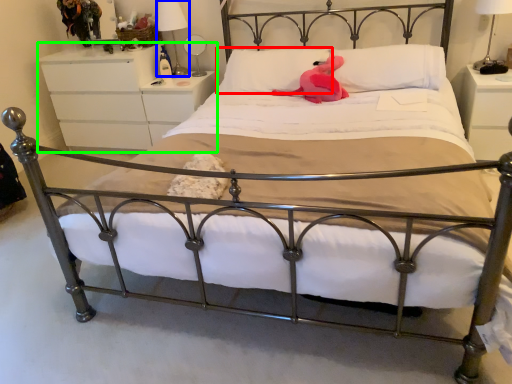
Question: Which object is the farthest from pillow (highlighted by a red box)? Choose among these: bedside lamp (highlighted by a blue box) or nightstand (highlighted by a green box).

Choices:
 (A) bedside lamp
 (B) nightstand

Answer: (A)